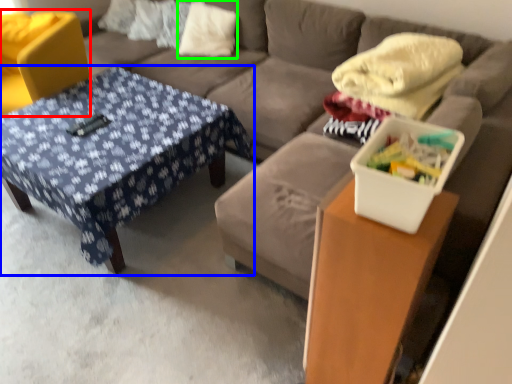
Question: Which object is the closest to the swivel chair (highlighted by a red box)? Choose among these: table (highlighted by a blue box) or pillow (highlighted by a green box).

Choices:
 (A) table
 (B) pillow

Answer: (A)